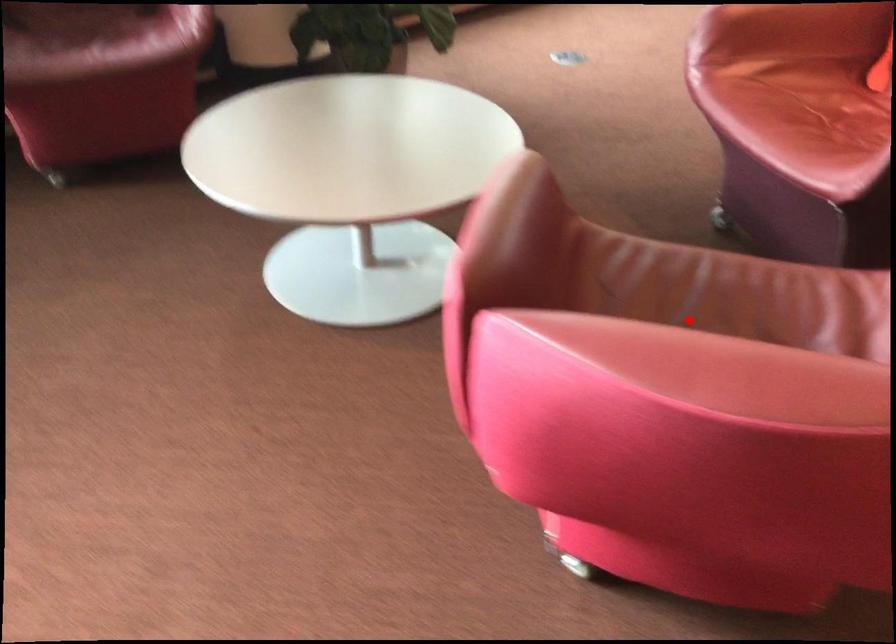
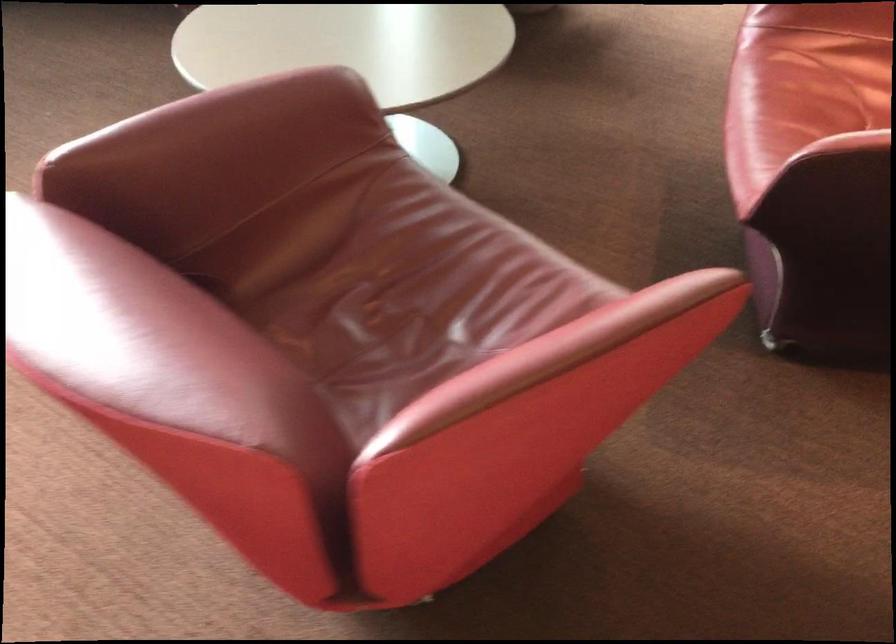
In the second image, find the point that corresponds to the highlighted location in the first image.

(392, 287)